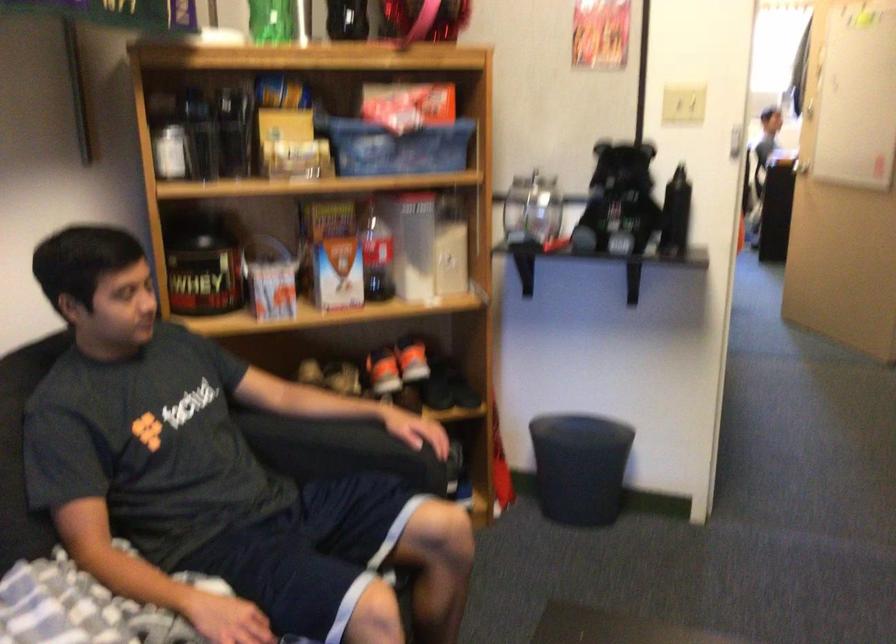
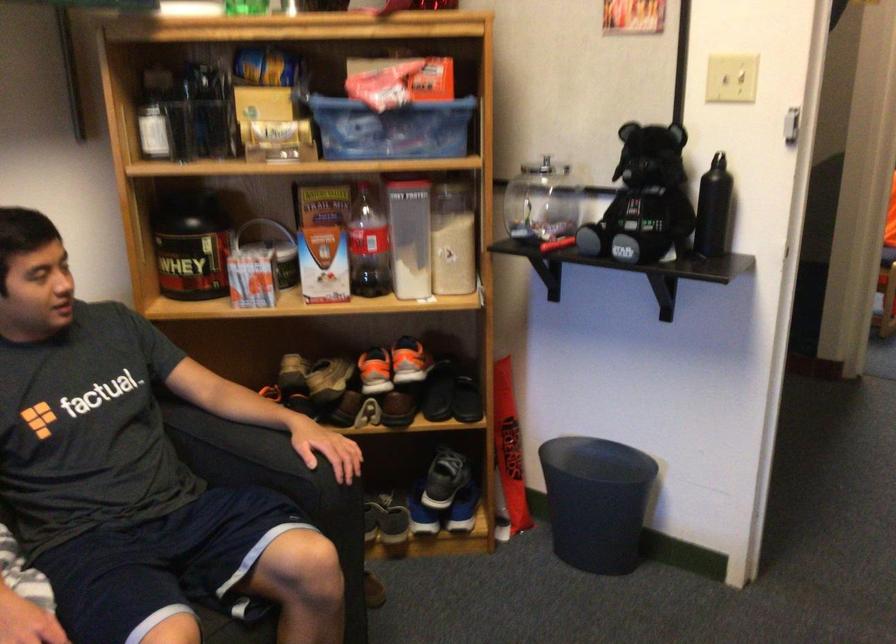
Where in the second image is the point corresponding to point 343,448 from the first image?

(250, 455)